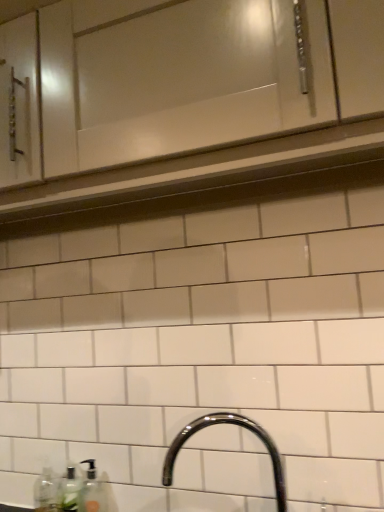
Where is `clear glass soap dispenser at lower left, the second bottle viewed from the left`? The width and height of the screenshot is (384, 512). clear glass soap dispenser at lower left, the second bottle viewed from the left is located at coordinates (69, 490).

The width and height of the screenshot is (384, 512). Identify the location of clear plastic bottle at lower left, which appears as the first bottle when viewed from the left. (46, 490).

In the scene shown: What is the approximate width of white glossy cabinet at upper center?

13.62 inches.

You are a GUI agent. You are given a task and a screenshot of the screen. Output one action in this format:
    pyautogui.click(x=<x>, y=<y>)
    Task: Click on the white glossy cabinet at upper center
    
    Given the screenshot: What is the action you would take?
    pyautogui.click(x=199, y=75)

Identify the location of clear glass soap dispenser at lower left, the second bottle viewed from the left. (69, 490).

Which of these two, glossy chrome faucet at lower center or clear glass soap dispenser at lower left, the second bottle viewed from the left, is wider?

glossy chrome faucet at lower center is wider.

Is glossy chrome faucet at lower center to the right of clear glass soap dispenser at lower left, the first bottle in the right-to-left sequence, from the viewer's perspective?

Yes.

Find the location of `the 1st bottle counting from the left of the glossy chrome faucet at lower center`. the 1st bottle counting from the left of the glossy chrome faucet at lower center is located at coordinates (69, 490).

From a real-world perspective, is glossy chrome faucet at lower center over clear glass soap dispenser at lower left, the first bottle in the right-to-left sequence?

Yes, from a real-world perspective, glossy chrome faucet at lower center is over clear glass soap dispenser at lower left, the first bottle in the right-to-left sequence

Where is `bottle that is the 2nd object located behind the white glossy cabinet at upper center`? The width and height of the screenshot is (384, 512). bottle that is the 2nd object located behind the white glossy cabinet at upper center is located at coordinates (46, 490).

Is white glossy cabinet at upper center inside or outside of clear plastic bottle at lower left, which appears as the first bottle when viewed from the left?

white glossy cabinet at upper center is spatially situated outside clear plastic bottle at lower left, which appears as the first bottle when viewed from the left.

Between white glossy cabinet at upper center and clear plastic bottle at lower left, which appears as the first bottle when viewed from the left, which one is positioned in front?

white glossy cabinet at upper center is in front.

Considering the sizes of objects glossy chrome faucet at lower center and translucent plastic soap dispenser at lower left in the image provided, who is smaller, glossy chrome faucet at lower center or translucent plastic soap dispenser at lower left?

With smaller size is translucent plastic soap dispenser at lower left.

From the image's perspective, between glossy chrome faucet at lower center and translucent plastic soap dispenser at lower left, who is located below?

From the image's view, translucent plastic soap dispenser at lower left is below.

From a real-world perspective, relative to translucent plastic soap dispenser at lower left, is glossy chrome faucet at lower center vertically above or below?

Clearly, from a real-world perspective, glossy chrome faucet at lower center is above translucent plastic soap dispenser at lower left.

Which object is further away from the camera, glossy chrome faucet at lower center or translucent plastic soap dispenser at lower left?

translucent plastic soap dispenser at lower left.

Could clear glass soap dispenser at lower left, the second bottle viewed from the left, be considered to be inside translucent plastic soap dispenser at lower left?

No, clear glass soap dispenser at lower left, the second bottle viewed from the left, is not a part of translucent plastic soap dispenser at lower left.

Is translucent plastic soap dispenser at lower left facing towards clear glass soap dispenser at lower left, the second bottle viewed from the left?

No, translucent plastic soap dispenser at lower left is not facing towards clear glass soap dispenser at lower left, the second bottle viewed from the left.

Does point (91, 482) appear closer or farther from the camera than point (76, 507)?

Point (91, 482) is positioned farther from the camera compared to point (76, 507).

Is translucent plastic soap dispenser at lower left to the left of clear glass soap dispenser at lower left, the second bottle viewed from the left, from the viewer's perspective?

No, translucent plastic soap dispenser at lower left is not to the left of clear glass soap dispenser at lower left, the second bottle viewed from the left.

From the image's perspective, who appears lower, glossy chrome faucet at lower center or white glossy cabinet at upper center?

From the image's view, glossy chrome faucet at lower center is below.

Which of these two, glossy chrome faucet at lower center or white glossy cabinet at upper center, is bigger?

white glossy cabinet at upper center.

Is glossy chrome faucet at lower center wider than white glossy cabinet at upper center?

Indeed, glossy chrome faucet at lower center has a greater width compared to white glossy cabinet at upper center.

Identify the location of sink on the right of white glossy cabinet at upper center. (229, 424).

Is clear plastic bottle at lower left, the 2th bottle positioned from the right, far from clear glass soap dispenser at lower left, the second bottle viewed from the left?

No.

Can you confirm if clear plastic bottle at lower left, the 2th bottle positioned from the right, is positioned to the left of clear glass soap dispenser at lower left, the second bottle viewed from the left?

Yes, clear plastic bottle at lower left, the 2th bottle positioned from the right, is to the left of clear glass soap dispenser at lower left, the second bottle viewed from the left.

The image size is (384, 512). I want to click on bottle behind the clear glass soap dispenser at lower left, the second bottle viewed from the left, so click(x=46, y=490).

Is clear plastic bottle at lower left, which appears as the first bottle when viewed from the left, taller or shorter than clear glass soap dispenser at lower left, the second bottle viewed from the left?

In the image, clear plastic bottle at lower left, which appears as the first bottle when viewed from the left, appears to be taller than clear glass soap dispenser at lower left, the second bottle viewed from the left.

Is clear plastic bottle at lower left, which appears as the first bottle when viewed from the left, at the right side of glossy chrome faucet at lower center?

In fact, clear plastic bottle at lower left, which appears as the first bottle when viewed from the left, is to the left of glossy chrome faucet at lower center.

Which object is further away from the camera, clear plastic bottle at lower left, the 2th bottle positioned from the right, or glossy chrome faucet at lower center?

clear plastic bottle at lower left, the 2th bottle positioned from the right, is further from the camera.

Would you consider clear plastic bottle at lower left, the 2th bottle positioned from the right, to be distant from glossy chrome faucet at lower center?

clear plastic bottle at lower left, the 2th bottle positioned from the right, is near glossy chrome faucet at lower center, not far away.

Find the location of `bottle that is the 1st one when counting leftward from the glossy chrome faucet at lower center`. bottle that is the 1st one when counting leftward from the glossy chrome faucet at lower center is located at coordinates click(69, 490).

Identify the location of the 2nd bottle below when counting from the white glossy cabinet at upper center (from the image's perspective). The image size is (384, 512). pos(46,490).

Considering their positions, is clear glass soap dispenser at lower left, the second bottle viewed from the left, positioned further to glossy chrome faucet at lower center than translucent plastic soap dispenser at lower left?

The object further to glossy chrome faucet at lower center is clear glass soap dispenser at lower left, the second bottle viewed from the left.

Considering their positions, is white glossy cabinet at upper center positioned further to glossy chrome faucet at lower center than clear plastic bottle at lower left, the 2th bottle positioned from the right?

white glossy cabinet at upper center is positioned further to the anchor glossy chrome faucet at lower center.

Based on their spatial positions, is clear plastic bottle at lower left, which appears as the first bottle when viewed from the left, or white glossy cabinet at upper center further from clear glass soap dispenser at lower left, the first bottle in the right-to-left sequence?

white glossy cabinet at upper center.

Which object lies nearer to the anchor point clear plastic bottle at lower left, which appears as the first bottle when viewed from the left, glossy chrome faucet at lower center or translucent plastic soap dispenser at lower left?

translucent plastic soap dispenser at lower left.

Which object lies nearer to the anchor point white glossy cabinet at upper center, translucent plastic soap dispenser at lower left or glossy chrome faucet at lower center?

Based on the image, glossy chrome faucet at lower center appears to be nearer to white glossy cabinet at upper center.

From the image, which object appears to be nearer to clear glass soap dispenser at lower left, the first bottle in the right-to-left sequence, translucent plastic soap dispenser at lower left or clear plastic bottle at lower left, which appears as the first bottle when viewed from the left?

translucent plastic soap dispenser at lower left lies closer to clear glass soap dispenser at lower left, the first bottle in the right-to-left sequence, than the other object.

Estimate the real-world distances between objects in this image. Which object is closer to clear plastic bottle at lower left, which appears as the first bottle when viewed from the left, glossy chrome faucet at lower center or white glossy cabinet at upper center?

Based on the image, glossy chrome faucet at lower center appears to be nearer to clear plastic bottle at lower left, which appears as the first bottle when viewed from the left.

Based on the photo, when comparing their distances from clear plastic bottle at lower left, the 2th bottle positioned from the right, does glossy chrome faucet at lower center or clear glass soap dispenser at lower left, the second bottle viewed from the left, seem closer?

clear glass soap dispenser at lower left, the second bottle viewed from the left, is closer to clear plastic bottle at lower left, the 2th bottle positioned from the right.

This screenshot has height=512, width=384. I want to click on soap dispenser between white glossy cabinet at upper center and clear glass soap dispenser at lower left, the first bottle in the right-to-left sequence, in the vertical direction, so click(x=92, y=490).

You are a GUI agent. You are given a task and a screenshot of the screen. Output one action in this format:
    pyautogui.click(x=<x>, y=<y>)
    Task: Click on the bottle between white glossy cabinet at upper center and clear plastic bottle at lower left, the 2th bottle positioned from the right, vertically
    The width and height of the screenshot is (384, 512).
    Given the screenshot: What is the action you would take?
    pyautogui.click(x=69, y=490)

This screenshot has width=384, height=512. Find the location of `soap dispenser between white glossy cabinet at upper center and clear plastic bottle at lower left, the 2th bottle positioned from the right, in the up-down direction`. soap dispenser between white glossy cabinet at upper center and clear plastic bottle at lower left, the 2th bottle positioned from the right, in the up-down direction is located at coordinates (92, 490).

At what (x,y) coordinates should I click in order to perform the action: click on soap dispenser between glossy chrome faucet at lower center and clear plastic bottle at lower left, which appears as the first bottle when viewed from the left, in the front-back direction. Please return your answer as a coordinate pair (x, y). Image resolution: width=384 pixels, height=512 pixels. Looking at the image, I should click on (92, 490).